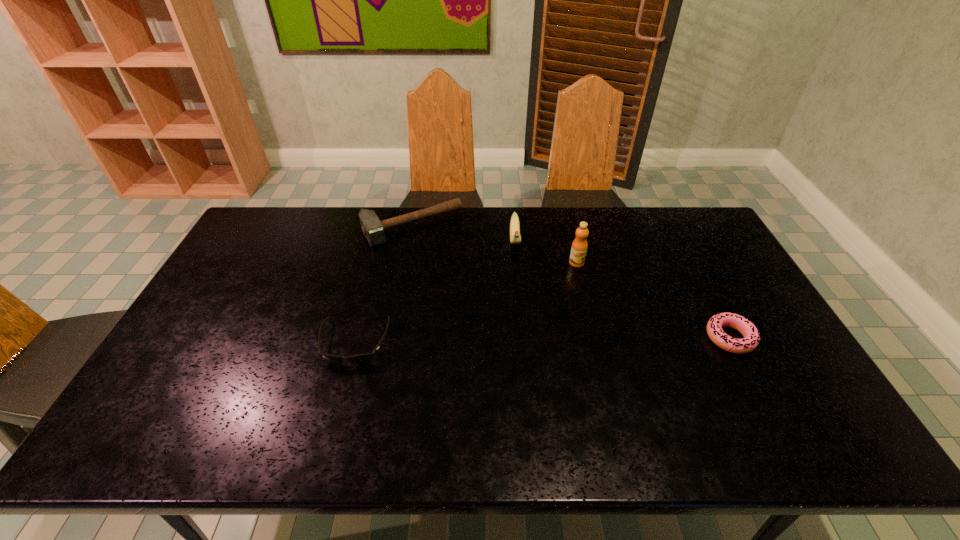
Where is `object at the right edge`? This screenshot has height=540, width=960. object at the right edge is located at coordinates (750, 332).

Image resolution: width=960 pixels, height=540 pixels. In order to click on vacant space at the far edge of the desktop in this screenshot , I will do `click(445, 214)`.

In the image, there is a desktop. Identify the location of vacant space at the near edge. (727, 397).

In the image, there is a desktop. Where is `vacant space at the left edge`? This screenshot has width=960, height=540. vacant space at the left edge is located at coordinates (248, 285).

In the image, there is a desktop. Where is `vacant space at the right edge`? This screenshot has width=960, height=540. vacant space at the right edge is located at coordinates (776, 376).

The height and width of the screenshot is (540, 960). In the image, there is a desktop. In order to click on vacant area at the far left corner in this screenshot , I will do `click(282, 218)`.

Locate an element on the screen. unoccupied area between the second object from right to left and the rightmost object is located at coordinates (653, 300).

Identify the location of vacant area between the sunglasses and the doughnut. This screenshot has width=960, height=540. (542, 340).

Locate an element on the screen. Image resolution: width=960 pixels, height=540 pixels. vacant space in between the fourth shortest object and the sunglasses is located at coordinates (435, 292).

Find the location of a particular element. This screenshot has height=540, width=960. blank region between the third tallest object and the sunglasses is located at coordinates (383, 285).